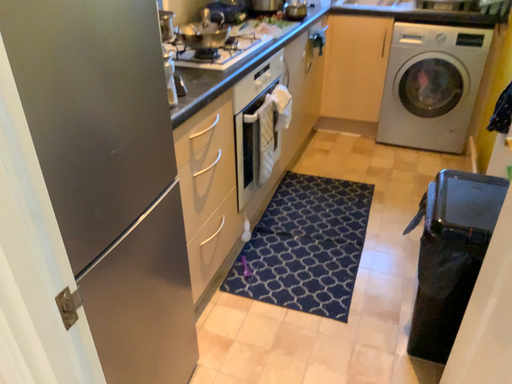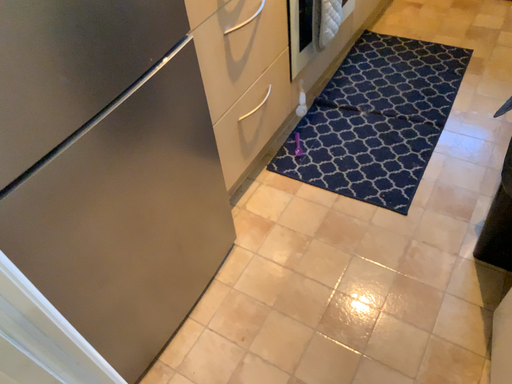
Question: Which way did the camera rotate in the video?

Choices:
 (A) rotated upward
 (B) rotated downward

Answer: (B)